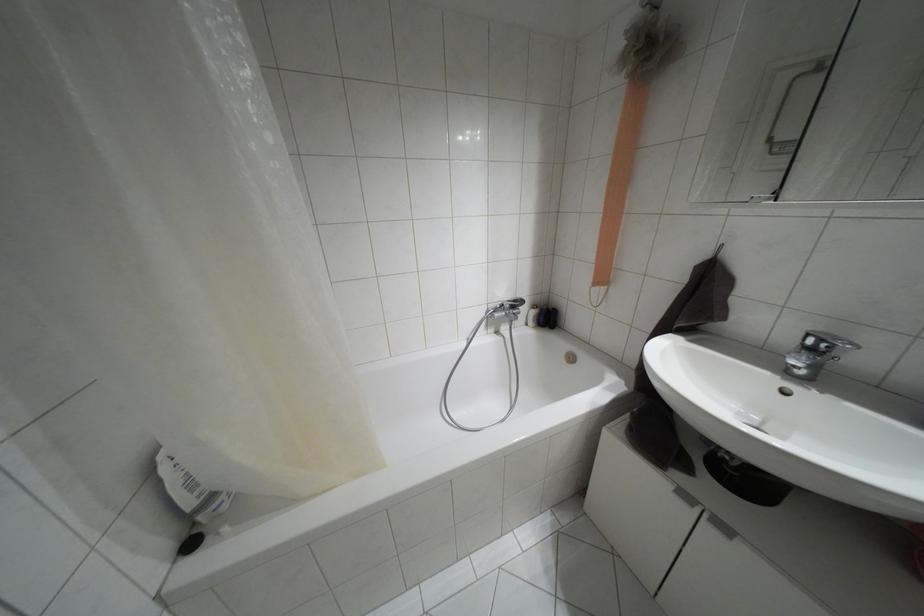
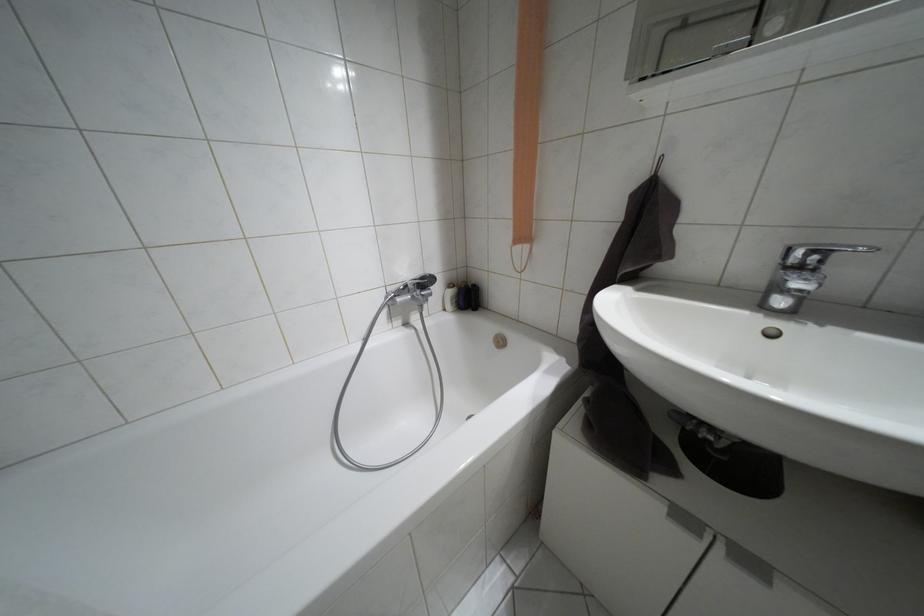
Locate, in the second image, the point that corresponds to point 685,496 in the first image.

(684, 517)